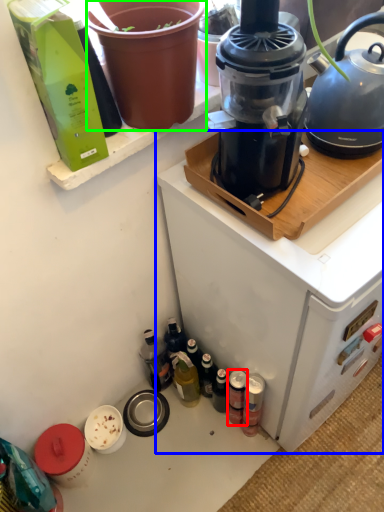
Question: Which object is the closest to the bottle (highlighted by a red box)? Choose among these: appliance (highlighted by a blue box) or flowerpot (highlighted by a green box).

Choices:
 (A) appliance
 (B) flowerpot

Answer: (A)